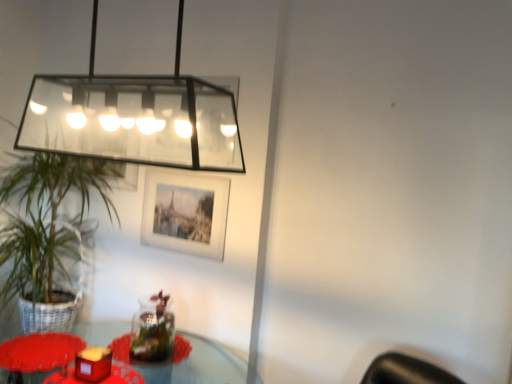
The width and height of the screenshot is (512, 384). What are the coordinates of `vacant space behind matte red candle holder at lower left` in the screenshot? It's located at (x=102, y=359).